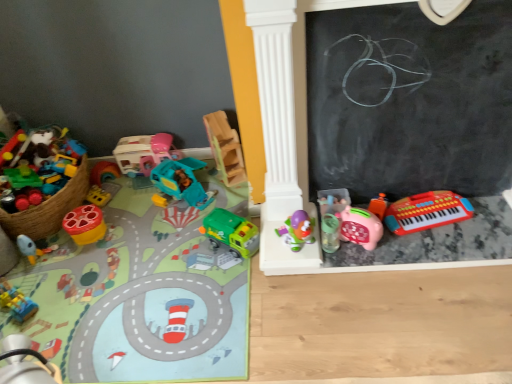
What do you see at coordinates (351, 220) in the screenshot? I see `pink plastic piggy bank at lower right, the second toy positioned from the right` at bounding box center [351, 220].

Find the location of a particular element. This screenshot has width=512, height=384. teal plastic car at center, positioned as the sixth toy in left-to-right order is located at coordinates (181, 183).

What do you see at coordinates (410, 100) in the screenshot? Image resolution: width=512 pixels, height=384 pixels. I see `black chalkboard at right` at bounding box center [410, 100].

Image resolution: width=512 pixels, height=384 pixels. Describe the element at coordinates (144, 153) in the screenshot. I see `translucent plastic playhouse at center-left, the 5th toy viewed from the left` at that location.

Locate an element on the screen. The height and width of the screenshot is (384, 512). pink plastic piggy bank at lower right, placed as the 11th toy when sorted from left to right is located at coordinates (351, 220).

Where is `the 5th toy below the shiny plastic toy at left, arranged as the 3th toy when viewed from the left (from the image's perspective)`? This screenshot has height=384, width=512. the 5th toy below the shiny plastic toy at left, arranged as the 3th toy when viewed from the left (from the image's perspective) is located at coordinates (142, 293).

Between matte plastic toy car at left, positioned as the 9th toy in right-to-left order, and shiny plastic toy at left, the tenth toy positioned from the right, which one has smaller width?

shiny plastic toy at left, the tenth toy positioned from the right, is thinner.

Is matte plastic toy car at left, positioned as the 9th toy in right-to-left order, bigger than shiny plastic toy at left, the tenth toy positioned from the right?

Correct, matte plastic toy car at left, positioned as the 9th toy in right-to-left order, is larger in size than shiny plastic toy at left, the tenth toy positioned from the right.

Based on the photo, from the image's perspective, is matte plastic toy car at left, positioned as the 9th toy in right-to-left order, under shiny plastic toy at left, the tenth toy positioned from the right?

Correct, matte plastic toy car at left, positioned as the 9th toy in right-to-left order, appears lower than shiny plastic toy at left, the tenth toy positioned from the right, in the image.

Is plastic yellow car at lower left, arranged as the eleventh toy when viewed from the right, smaller than black chalkboard at right?

Correct, plastic yellow car at lower left, arranged as the eleventh toy when viewed from the right, occupies less space than black chalkboard at right.

Considering the relative positions of plastic yellow car at lower left, arranged as the eleventh toy when viewed from the right, and black chalkboard at right in the image provided, is plastic yellow car at lower left, arranged as the eleventh toy when viewed from the right, to the right of black chalkboard at right from the viewer's perspective?

No.

From the image's perspective, does plastic yellow car at lower left, arranged as the eleventh toy when viewed from the right, appear lower than black chalkboard at right?

Yes, from the image's perspective, plastic yellow car at lower left, arranged as the eleventh toy when viewed from the right, is beneath black chalkboard at right.

Is wooden blocks at center, which is the 7th toy from left to right, to the left or to the right of purple plastic toy at center, which is counted as the fourth toy, starting from the right, in the image?

In the image, wooden blocks at center, which is the 7th toy from left to right, appears on the left side of purple plastic toy at center, which is counted as the fourth toy, starting from the right.

How different are the orientations of wooden blocks at center, which is the 7th toy from left to right, and purple plastic toy at center, which is counted as the fourth toy, starting from the right, in degrees?

The angular difference between wooden blocks at center, which is the 7th toy from left to right, and purple plastic toy at center, which is counted as the fourth toy, starting from the right, is 19.5 degrees.

From the image's perspective, which one is positioned higher, wooden blocks at center, which is the 7th toy from left to right, or purple plastic toy at center, which is counted as the fourth toy, starting from the right?

wooden blocks at center, which is the 7th toy from left to right, is shown above in the image.

Is wooden blocks at center, the sixth toy in the right-to-left sequence, positioned behind purple plastic toy at center, the 9th toy in the left-to-right sequence?

Yes.

From a real-world perspective, is matte plastic toy car at left, the fourth toy from the left, under purple plastic toy at center, the 9th toy in the left-to-right sequence?

Yes, from a real-world perspective, matte plastic toy car at left, the fourth toy from the left, is beneath purple plastic toy at center, the 9th toy in the left-to-right sequence.

From the matte plastic toy car at left, the fourth toy from the left, count 2nd toys backward and point to it. Please provide its 2D coordinates.

[(297, 230)]

Which point is more forward, (75, 314) or (298, 231)?

The point (75, 314) is more forward.

From a real-world perspective, is translucent plastic playhouse at center-left, the eighth toy from the right, under shiny plastic toy at left, the tenth toy positioned from the right?

No, from a real-world perspective, translucent plastic playhouse at center-left, the eighth toy from the right, is not beneath shiny plastic toy at left, the tenth toy positioned from the right.

From the picture: Does translucent plastic playhouse at center-left, the eighth toy from the right, lie behind shiny plastic toy at left, arranged as the 3th toy when viewed from the left?

Yes, it is behind shiny plastic toy at left, arranged as the 3th toy when viewed from the left.

At what (x,y) coordinates should I click in order to perform the action: click on the 4th toy below when counting from the translucent plastic playhouse at center-left, the eighth toy from the right (from the image's perspective). Please return your answer as a coordinate pair (x, y). The image size is (512, 384). Looking at the image, I should click on 85,224.

Is translucent plastic playhouse at center-left, the eighth toy from the right, to the left or to the right of shiny plastic toy at left, the tenth toy positioned from the right, in the image?

translucent plastic playhouse at center-left, the eighth toy from the right, is positioned on shiny plastic toy at left, the tenth toy positioned from the right,'s right side.

Is shiny plastic toy at left, the tenth toy positioned from the right, oriented towards pink plastic piggy bank at lower right, placed as the 11th toy when sorted from left to right?

No, shiny plastic toy at left, the tenth toy positioned from the right, is not oriented towards pink plastic piggy bank at lower right, placed as the 11th toy when sorted from left to right.

Does shiny plastic toy at left, the tenth toy positioned from the right, have a smaller size compared to pink plastic piggy bank at lower right, the second toy positioned from the right?

Incorrect, shiny plastic toy at left, the tenth toy positioned from the right, is not smaller in size than pink plastic piggy bank at lower right, the second toy positioned from the right.

From a real-world perspective, who is located higher, shiny plastic toy at left, arranged as the 3th toy when viewed from the left, or pink plastic piggy bank at lower right, the second toy positioned from the right?

From a 3D spatial view, pink plastic piggy bank at lower right, the second toy positioned from the right, is above.

Considering their positions, is shiny plastic toy at left, the tenth toy positioned from the right, located in front of or behind teal plastic car at center, positioned as the sixth toy in left-to-right order?

Visually, shiny plastic toy at left, the tenth toy positioned from the right, is located in front of teal plastic car at center, positioned as the sixth toy in left-to-right order.

Which of these two, shiny plastic toy at left, arranged as the 3th toy when viewed from the left, or teal plastic car at center, positioned as the sixth toy in left-to-right order, stands shorter?

With less height is shiny plastic toy at left, arranged as the 3th toy when viewed from the left.

From a real-world perspective, is shiny plastic toy at left, the tenth toy positioned from the right, above or below teal plastic car at center, marked as the 7th toy in a right-to-left arrangement?

shiny plastic toy at left, the tenth toy positioned from the right, is situated lower than teal plastic car at center, marked as the 7th toy in a right-to-left arrangement, in the real world.

Could you tell me if shiny plastic toy at left, arranged as the 3th toy when viewed from the left, is facing teal plastic car at center, marked as the 7th toy in a right-to-left arrangement?

No.

This screenshot has height=384, width=512. I want to click on toy that is the 5th object located below the shiny plastic toy at left, arranged as the 3th toy when viewed from the left (from the image's perspective), so click(x=142, y=293).

At what (x,y) coordinates should I click in order to perform the action: click on bulletin board to the right of plastic yellow car at lower left, positioned as the 2th toy in left-to-right order. Please return your answer as a coordinate pair (x, y). Looking at the image, I should click on (410, 100).

From the image, which object appears to be nearer to green plastic toy truck at center, the 5th toy from the right, matte plastic toy car at left, positioned as the 9th toy in right-to-left order, or plastic yellow car at lower left, arranged as the eleventh toy when viewed from the right?

Among the two, matte plastic toy car at left, positioned as the 9th toy in right-to-left order, is located nearer to green plastic toy truck at center, the 5th toy from the right.

Looking at the image, which one is located further to pink plastic piggy bank at lower right, the second toy positioned from the right, matte plastic toy car at left, the fourth toy from the left, or teal plastic car at center, marked as the 7th toy in a right-to-left arrangement?

Based on the image, matte plastic toy car at left, the fourth toy from the left, appears to be further to pink plastic piggy bank at lower right, the second toy positioned from the right.

When comparing their distances from shiny plastic toy at left, the tenth toy positioned from the right, does matte plastic toy rocket at lower left, the first toy from the left, or matte plastic toy car at left, positioned as the 9th toy in right-to-left order, seem further?

Among the two, matte plastic toy car at left, positioned as the 9th toy in right-to-left order, is located further to shiny plastic toy at left, the tenth toy positioned from the right.

When comparing their distances from purple plastic toy at center, which is counted as the fourth toy, starting from the right, does black chalkboard at right or teal plastic car at center, marked as the 7th toy in a right-to-left arrangement, seem further?

teal plastic car at center, marked as the 7th toy in a right-to-left arrangement.

Which object lies nearer to the anchor point plastic yellow car at lower left, positioned as the 2th toy in left-to-right order, matte plastic toy rocket at lower left, which is the 12th toy from right to left, or matte plastic toy car at left, positioned as the 9th toy in right-to-left order?

matte plastic toy rocket at lower left, which is the 12th toy from right to left, is positioned closer to the anchor plastic yellow car at lower left, positioned as the 2th toy in left-to-right order.

Considering their positions, is plastic yellow car at lower left, arranged as the eleventh toy when viewed from the right, positioned further to translucent plastic playhouse at center-left, the eighth toy from the right, than clear plastic water bottle at center-right, arranged as the third toy when viewed from the right?

clear plastic water bottle at center-right, arranged as the third toy when viewed from the right.

Looking at the image, which one is located closer to clear plastic water bottle at center-right, arranged as the third toy when viewed from the right, pink plastic piggy bank at lower right, the second toy positioned from the right, or black chalkboard at right?

Based on the image, pink plastic piggy bank at lower right, the second toy positioned from the right, appears to be nearer to clear plastic water bottle at center-right, arranged as the third toy when viewed from the right.

Looking at the image, which one is located closer to wooden blocks at center, which is the 7th toy from left to right, translucent plastic playhouse at center-left, the 5th toy viewed from the left, or black chalkboard at right?

translucent plastic playhouse at center-left, the 5th toy viewed from the left, lies closer to wooden blocks at center, which is the 7th toy from left to right, than the other object.

I want to click on toy located between purple plastic toy at center, which is counted as the fourth toy, starting from the right, and pink plastic piggy bank at lower right, placed as the 11th toy when sorted from left to right, in the left-right direction, so click(330, 233).

At what (x,y) coordinates should I click in order to perform the action: click on bulletin board between translucent plastic playhouse at center-left, the 5th toy viewed from the left, and rubberized plastic keyboard at lower right, which appears as the first toy when viewed from the right. Please return your answer as a coordinate pair (x, y). Looking at the image, I should click on (410, 100).

The height and width of the screenshot is (384, 512). I want to click on bulletin board located between matte plastic toy car at left, the fourth toy from the left, and rubberized plastic keyboard at lower right, the twelfth toy from the left, in the left-right direction, so click(410, 100).

Locate an element on the screen. This screenshot has width=512, height=384. toy between green plastic toy truck at center, the 5th toy from the right, and clear plastic water bottle at center-right, arranged as the third toy when viewed from the right, from left to right is located at coordinates [x=297, y=230].